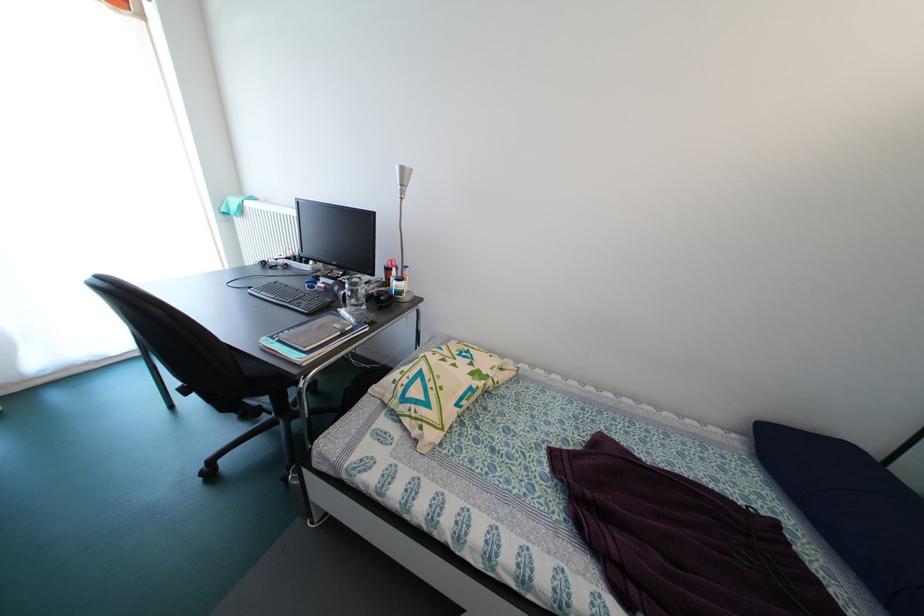
This screenshot has height=616, width=924. What do you see at coordinates (201, 365) in the screenshot?
I see `the black chair sitting surface` at bounding box center [201, 365].